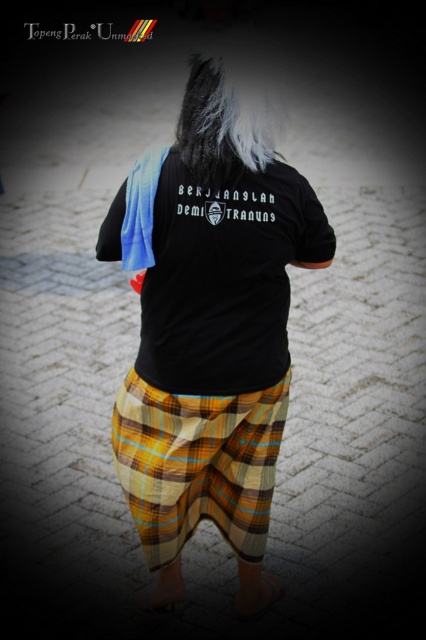
Question: Which is farther from the white silky hair at upper center?

Choices:
 (A) black cotton t-shirt at center
 (B) yellow plaid sarong at center

Answer: (B)

Question: Can you confirm if yellow plaid sarong at center is positioned to the left of white silky hair at upper center?

Choices:
 (A) yes
 (B) no

Answer: (A)

Question: Which point is closer to the camera taking this photo?

Choices:
 (A) (244, 323)
 (B) (250, 477)

Answer: (A)

Question: Does yellow plaid sarong at center have a smaller size compared to white silky hair at upper center?

Choices:
 (A) yes
 (B) no

Answer: (B)

Question: Does black cotton t-shirt at center appear under white silky hair at upper center?

Choices:
 (A) yes
 (B) no

Answer: (A)

Question: Which point is closer to the camera?

Choices:
 (A) (199, 106)
 (B) (195, 465)
 (C) (293, 253)

Answer: (A)